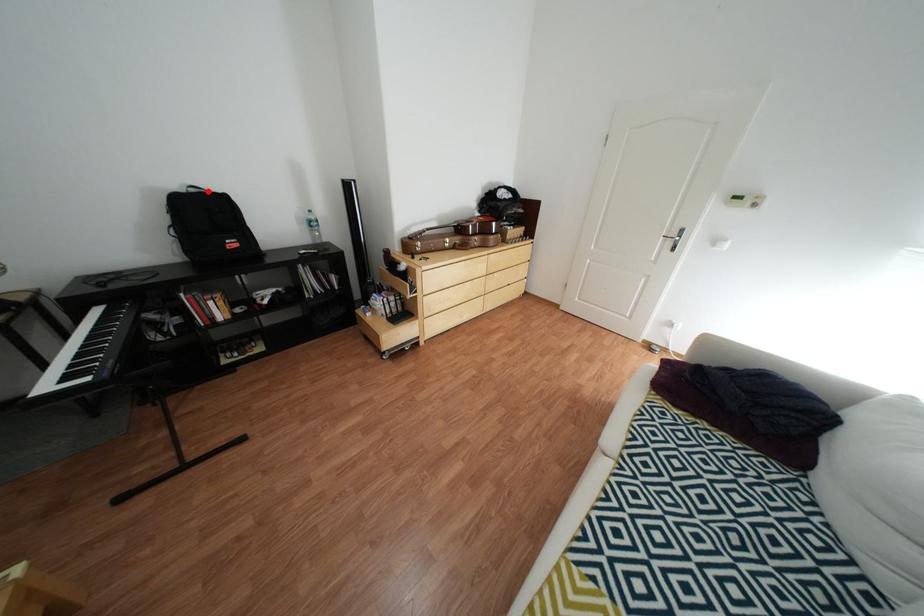
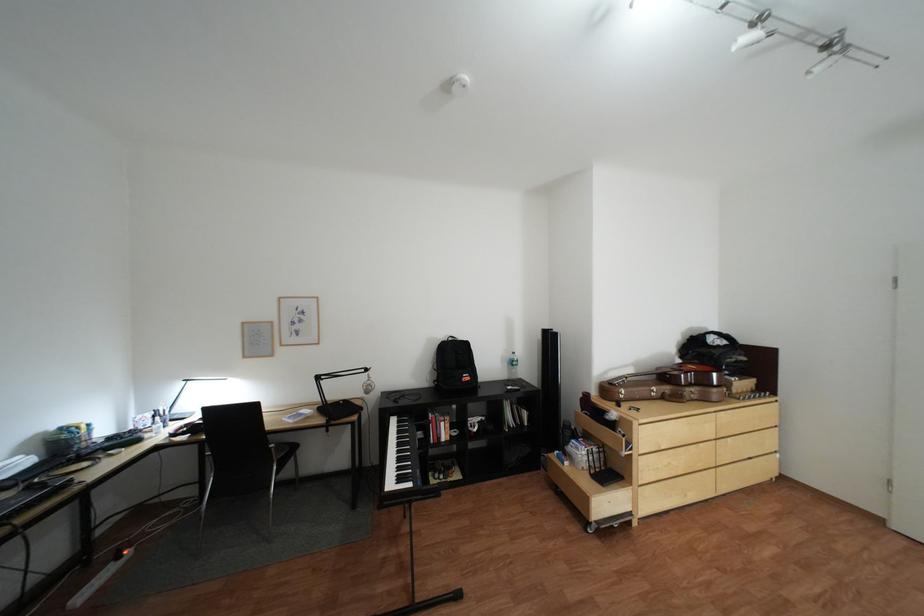
The point at the highlighted location is marked in the first image. Where is the corresponding point in the second image?

(466, 339)